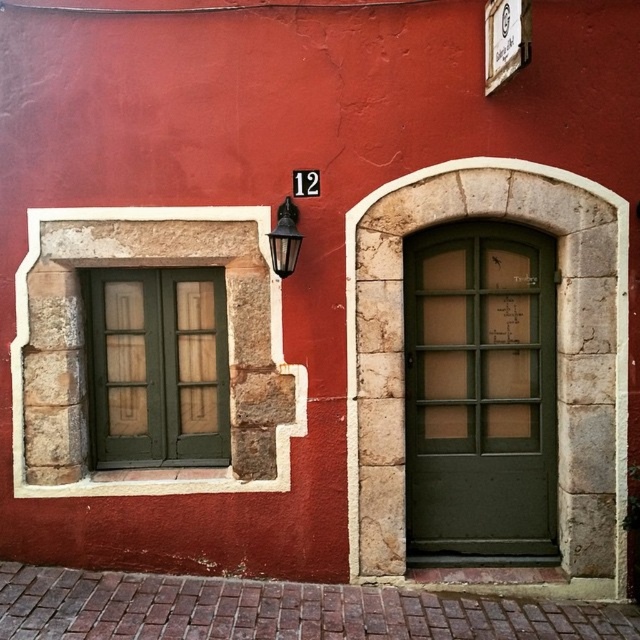
In the scene shown: Between green wood window at left and matte glass lamp at upper center, which one has more height?

Standing taller between the two is green wood window at left.

Is green wood window at left taller than matte glass lamp at upper center?

Yes, green wood window at left is taller than matte glass lamp at upper center.

Who is more forward, [221,442] or [291,204]?

Positioned in front is point [291,204].

Identify the location of green wood window at left. (157, 368).

Does green stone door at right appear on the right side of matte glass lamp at upper center?

Correct, you'll find green stone door at right to the right of matte glass lamp at upper center.

Where is `green stone door at right`? green stone door at right is located at coordinates (556, 346).

What do you see at coordinates (556, 346) in the screenshot? The height and width of the screenshot is (640, 640). I see `green stone door at right` at bounding box center [556, 346].

What are the coordinates of `green stone door at right` in the screenshot? It's located at (556, 346).

The width and height of the screenshot is (640, 640). Identify the location of green stone door at right. (556, 346).

Does green stone door at right lie behind green matte door at center?

No, it is not.

Where is `green stone door at right`? This screenshot has width=640, height=640. green stone door at right is located at coordinates (556, 346).